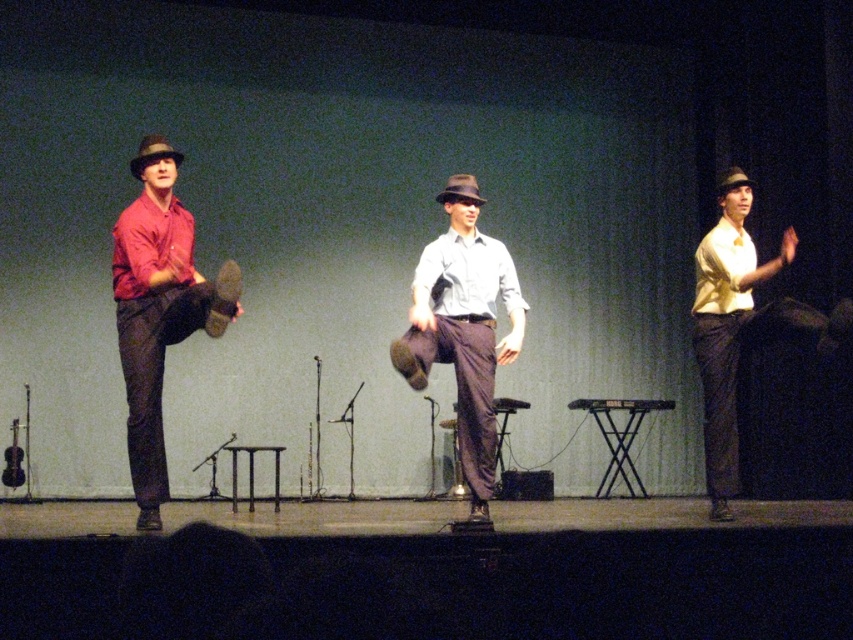
Can you confirm if matte yellow shirt at right is positioned above matte brown fedora at center?

No.

This screenshot has width=853, height=640. I want to click on matte yellow shirt at right, so click(x=729, y=326).

Between point (701, 248) and point (460, 193), which one is positioned in front?

Positioned in front is point (460, 193).

Find the location of a particular element. Image resolution: width=853 pixels, height=640 pixels. matte yellow shirt at right is located at coordinates (729, 326).

Between matte gray shirt at center and matte yellow shirt at right, which one is positioned lower?

matte gray shirt at center

Can you confirm if matte gray shirt at center is taller than matte yellow shirt at right?

No, matte gray shirt at center is not taller than matte yellow shirt at right.

Is point (427, 268) positioned before point (724, 356)?

That is True.

Locate an element on the screen. The image size is (853, 640). matte gray shirt at center is located at coordinates (463, 336).

Is matte red shirt at left wider than matte gray shirt at center?

Correct, the width of matte red shirt at left exceeds that of matte gray shirt at center.

Between matte red shirt at left and matte gray shirt at center, which one has more height?

With more height is matte red shirt at left.

Identify the location of matte red shirt at left. This screenshot has height=640, width=853. (158, 308).

Where is `matte red shirt at left`? The width and height of the screenshot is (853, 640). matte red shirt at left is located at coordinates (158, 308).